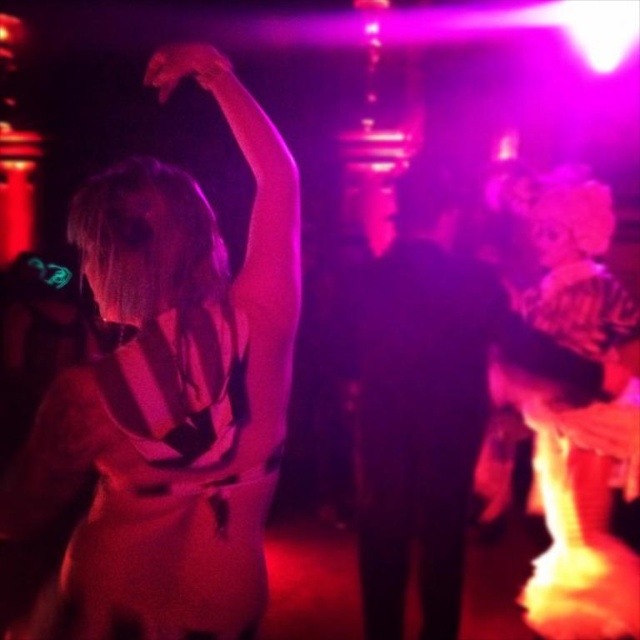
You are at a party and want to move from your current position to the exit, which is located at point (204, 64). There is an obstacle at point (193, 429). Can you safely walk around the obstacle to reach the exit?

Point (193, 429) is in front of point (204, 64), so the obstacle is blocking the path to the exit. You will need to find an alternative route to avoid the obstacle at point (193, 429) and reach the exit at point (204, 64).

You are at a party and want to grab the matte white dress at upper left. The matte black hand at upper left belongs to someone else. Can you reach the dress without touching the hand?

The distance between the matte white dress at upper left and the matte black hand at upper left is 20.46 inches, so you can reach the dress without touching the hand as the distance is sufficient.